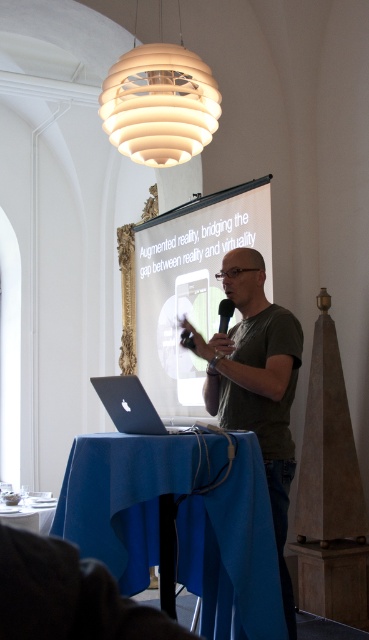
Can you confirm if silver metallic laptop at lower left is shorter than black plastic microphone at center?

In fact, silver metallic laptop at lower left may be taller than black plastic microphone at center.

Between silver metallic laptop at lower left and black plastic microphone at center, which one is positioned lower?

silver metallic laptop at lower left is lower down.

You are a GUI agent. You are given a task and a screenshot of the screen. Output one action in this format:
    pyautogui.click(x=<x>, y=<y>)
    Task: Click on the silver metallic laptop at lower left
    This screenshot has height=640, width=369.
    Given the screenshot: What is the action you would take?
    (130, 404)

Is point (159, 410) positioned behind point (129, 99)?

Yes, point (159, 410) is farther from viewer.

Which is more to the right, white glossy projector screen at center or white matte spherical lamp at upper center?

From the viewer's perspective, white glossy projector screen at center appears more on the right side.

Which is behind, point (232, 200) or point (160, 26)?

The point (160, 26) is behind.

Locate an element on the screen. white glossy projector screen at center is located at coordinates (191, 284).

Is point (70, 454) less distant than point (223, 314)?

Yes, point (70, 454) is closer to viewer.

Identify the location of blue fabric tablecloth at lower center. The width and height of the screenshot is (369, 640). (129, 493).

Does point (247, 560) come closer to viewer compared to point (219, 312)?

Yes, it is.

Identify the location of blue fabric tablecloth at lower center. (129, 493).